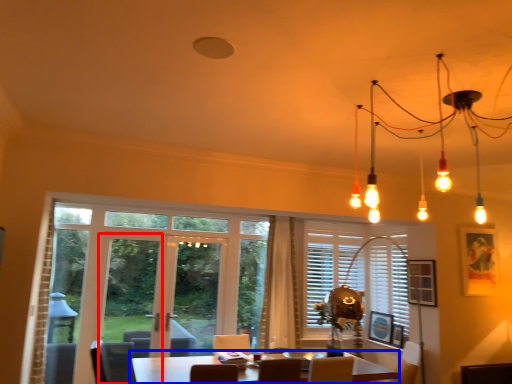
Question: Which point is closer to the camera, screen door (highlighted by a red box) or table (highlighted by a blue box)?

Choices:
 (A) screen door
 (B) table

Answer: (B)